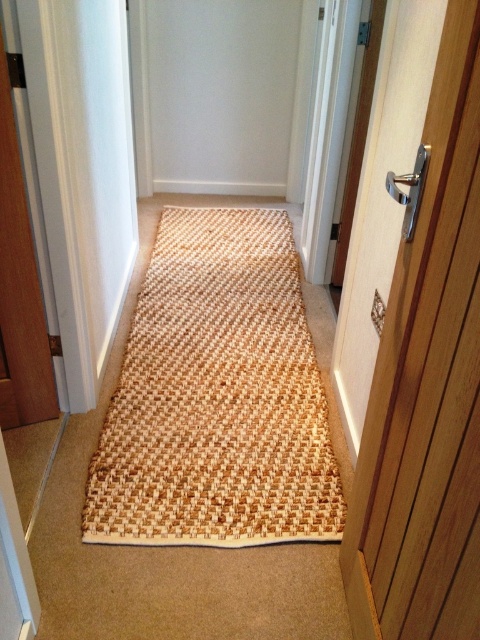
You are a delivery person carrying a large package and need to enter the room through the wooden door at right. The natural woven mat at center is in your way. Can you step over it to access the door?

The natural woven mat at center is above the wooden door at right, so stepping over the mat would allow you to reach the door since it is positioned higher up.

You are moving a large rectangular box that is 2 meters long. You are standing in the hallway and see the natural woven mat at center and the wooden door at right. Which object would the box most likely hit first as you move it through the hallway?

The box would most likely hit the natural woven mat at center first because it is larger in size compared to the wooden door at right, making it a bigger obstruction in the path.

You are standing at the entrance of the hallway and see a point marked at coordinates (216, 396). What object is located at that point?

The point at coordinates (216, 396) indicates the location of the natural woven mat at center.